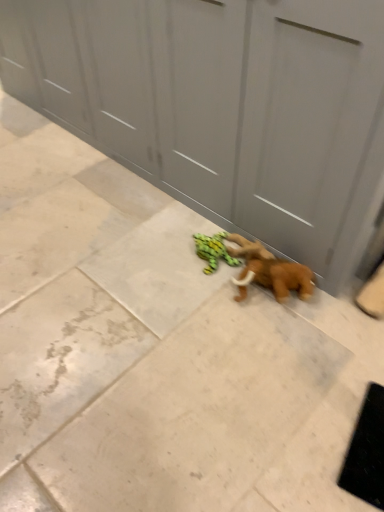
Where is `blank area beneath brown plush elephant at lower center (from a real-world perspective)`? The height and width of the screenshot is (512, 384). blank area beneath brown plush elephant at lower center (from a real-world perspective) is located at coordinates (274, 298).